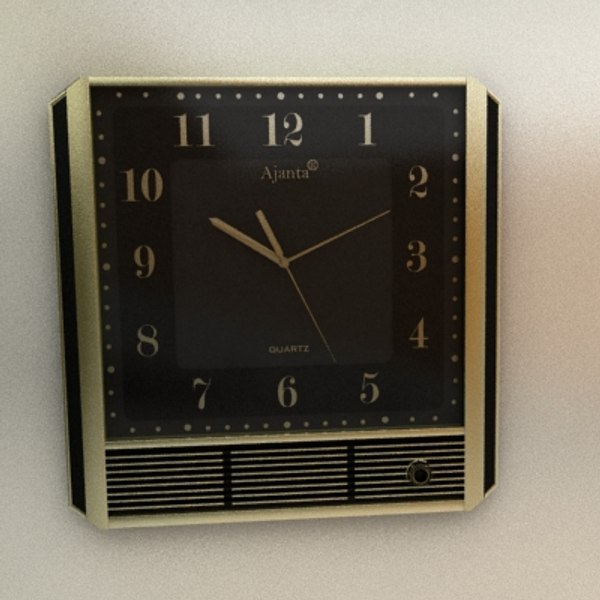
You are a GUI agent. You are given a task and a screenshot of the screen. Output one action in this format:
    pyautogui.click(x=<x>, y=<y>)
    Task: Click on the 12 on clock
    
    Given the screenshot: What is the action you would take?
    pyautogui.click(x=288, y=132)